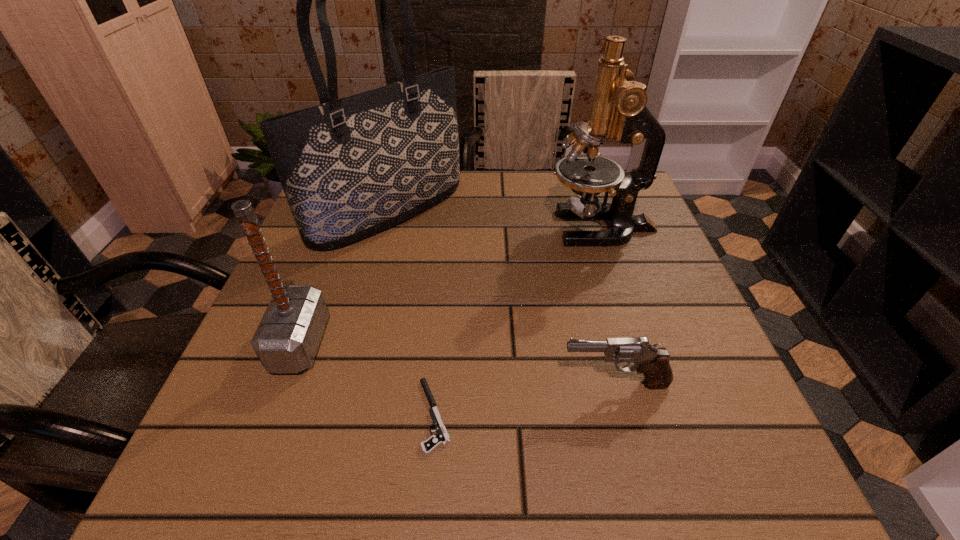
You are a GUI agent. You are given a task and a screenshot of the screen. Output one action in this format:
    pyautogui.click(x=<x>, y=<y>)
    Task: Click on the blank area at the right edge
    Image resolution: width=960 pixels, height=540 pixels.
    Given the screenshot: What is the action you would take?
    pyautogui.click(x=635, y=237)

The image size is (960, 540). I want to click on free space at the near right corner, so click(x=744, y=477).

Locate an element on the screen. The image size is (960, 540). vacant space that is in between the fourth shortest object and the fourth tallest object is located at coordinates (608, 306).

Identify the location of free space between the tote bag and the microscope. The image size is (960, 540). (494, 220).

Locate an element on the screen. free space between the right pistol and the third shortest object is located at coordinates (457, 363).

The image size is (960, 540). I want to click on free space between the hammer and the tote bag, so click(x=344, y=278).

The image size is (960, 540). I want to click on free point between the third shortest object and the tallest object, so click(344, 278).

The width and height of the screenshot is (960, 540). I want to click on blank region between the taller pistol and the shortest object, so click(524, 400).

Identify the location of unoccupied area between the second tallest object and the shortest object. (517, 321).

Locate an element on the screen. This screenshot has width=960, height=540. vacant area between the microscope and the tallest object is located at coordinates (494, 220).